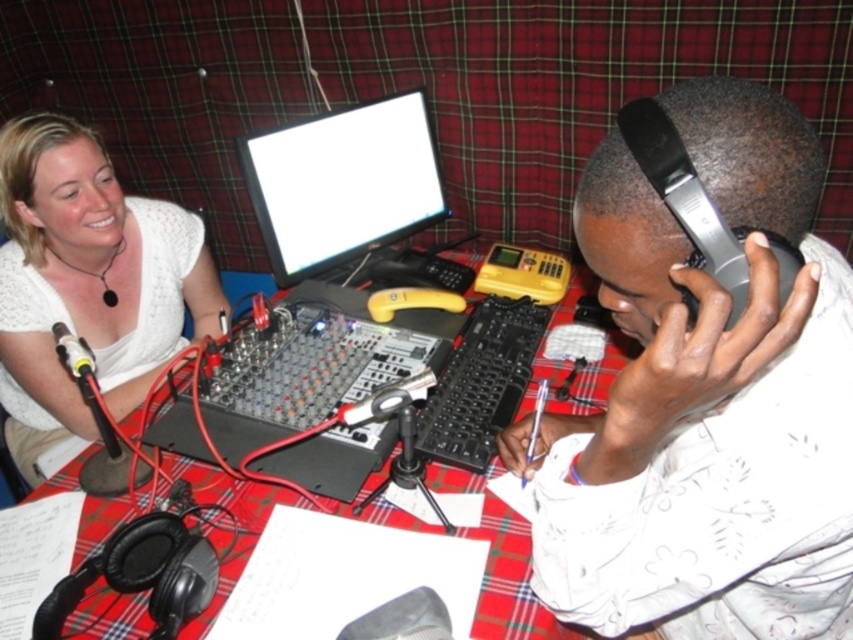
Looking at this image, is white glossy computer screen at upper center closer to the viewer compared to red plaid table at center?

No, it is not.

Is point (242, 173) closer to viewer compared to point (86, 500)?

No, (242, 173) is further to viewer.

Which is in front, point (387, 145) or point (508, 596)?

Point (508, 596) is more forward.

Identify the location of white glossy computer screen at upper center. The width and height of the screenshot is (853, 640). (343, 184).

Is matte black headphones at right to the right of white glossy computer screen at upper center from the viewer's perspective?

Yes, matte black headphones at right is to the right of white glossy computer screen at upper center.

Does matte black headphones at right appear under white glossy computer screen at upper center?

Yes, matte black headphones at right is below white glossy computer screen at upper center.

Is point (798, 116) less distant than point (425, 157)?

Yes, point (798, 116) is in front of point (425, 157).

The width and height of the screenshot is (853, 640). Identify the location of matte black headphones at right. (705, 401).

Is white lace shirt at upper left smaller than white glossy computer screen at upper center?

No, white lace shirt at upper left is not smaller than white glossy computer screen at upper center.

Which is above, white lace shirt at upper left or white glossy computer screen at upper center?

white glossy computer screen at upper center

The height and width of the screenshot is (640, 853). What do you see at coordinates (86, 282) in the screenshot?
I see `white lace shirt at upper left` at bounding box center [86, 282].

Locate an element on the screen. white lace shirt at upper left is located at coordinates (86, 282).